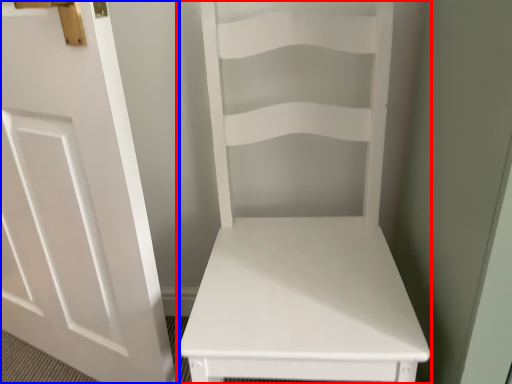
Question: Among these objects, which one is farthest to the camera, furniture (highlighted by a red box) or door (highlighted by a blue box)?

Choices:
 (A) furniture
 (B) door

Answer: (B)